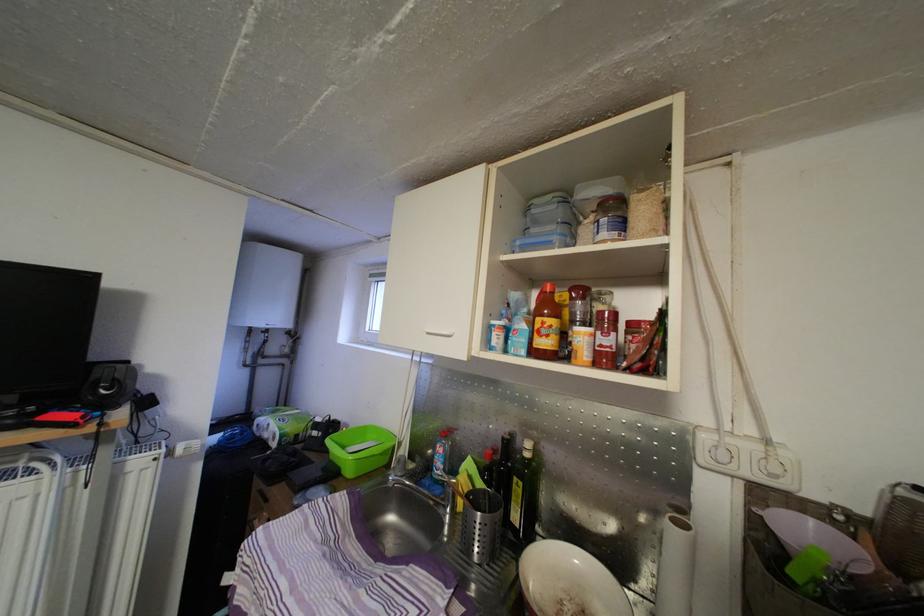
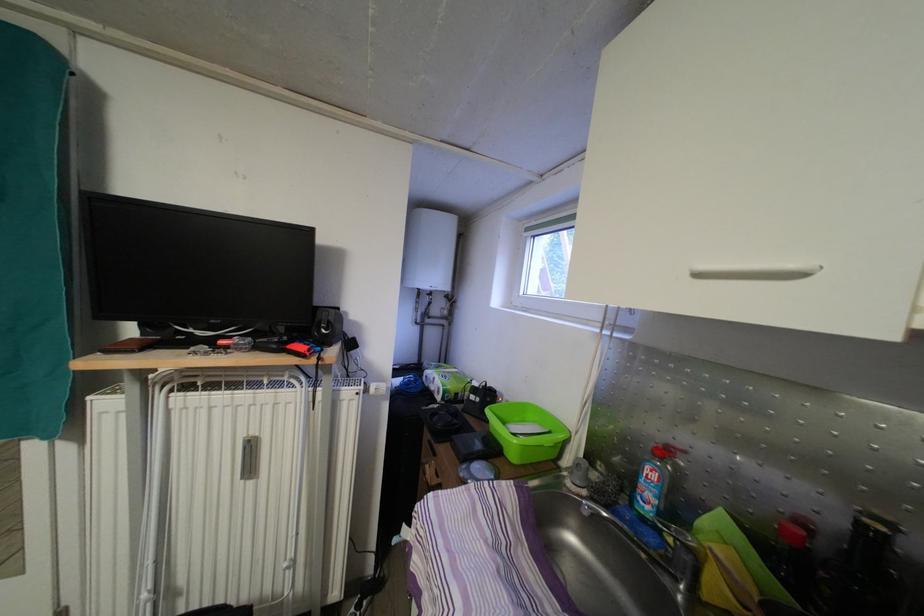
Where in the second image is the point corresponding to [169,456] from the first image?

(369, 394)